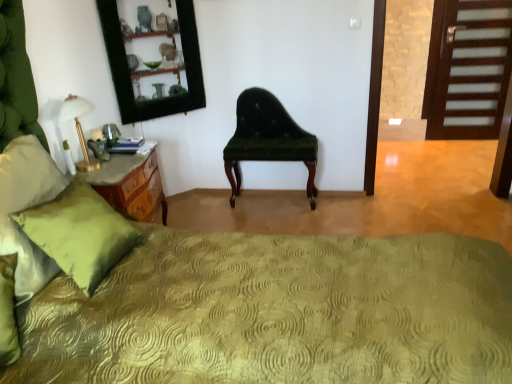
Question: Is velvet green chair at center outside of dark wood door at right?

Choices:
 (A) no
 (B) yes

Answer: (B)

Question: Is velvet green chair at center at the left side of dark wood door at right?

Choices:
 (A) yes
 (B) no

Answer: (A)

Question: From the image's perspective, does velvet green chair at center appear higher than dark wood door at right?

Choices:
 (A) yes
 (B) no

Answer: (B)

Question: Is velvet green chair at center turned away from dark wood door at right?

Choices:
 (A) no
 (B) yes

Answer: (A)

Question: Is velvet green chair at center not close to dark wood door at right?

Choices:
 (A) no
 (B) yes

Answer: (B)

Question: In terms of size, does green textured bedspread at center appear bigger or smaller than green glass mirror at upper left?

Choices:
 (A) small
 (B) big

Answer: (B)

Question: From a real-world perspective, is green textured bedspread at center above or below green glass mirror at upper left?

Choices:
 (A) below
 (B) above

Answer: (A)

Question: Is green textured bedspread at center wider or thinner than green glass mirror at upper left?

Choices:
 (A) wide
 (B) thin

Answer: (A)

Question: From the image's perspective, is green textured bedspread at center above or below green glass mirror at upper left?

Choices:
 (A) below
 (B) above

Answer: (A)

Question: Relative to green textured pillow at left, is white glass table lamp at left in front or behind?

Choices:
 (A) front
 (B) behind

Answer: (B)

Question: In terms of height, does white glass table lamp at left look taller or shorter compared to green textured pillow at left?

Choices:
 (A) short
 (B) tall

Answer: (A)

Question: From the image's perspective, relative to green textured pillow at left, is white glass table lamp at left above or below?

Choices:
 (A) below
 (B) above

Answer: (B)

Question: Would you say white glass table lamp at left is inside or outside green textured pillow at left?

Choices:
 (A) inside
 (B) outside

Answer: (B)

Question: Is green textured pillow at left in front of or behind green glass mirror at upper left in the image?

Choices:
 (A) front
 (B) behind

Answer: (A)

Question: From their relative heights in the image, would you say green textured pillow at left is taller or shorter than green glass mirror at upper left?

Choices:
 (A) tall
 (B) short

Answer: (B)